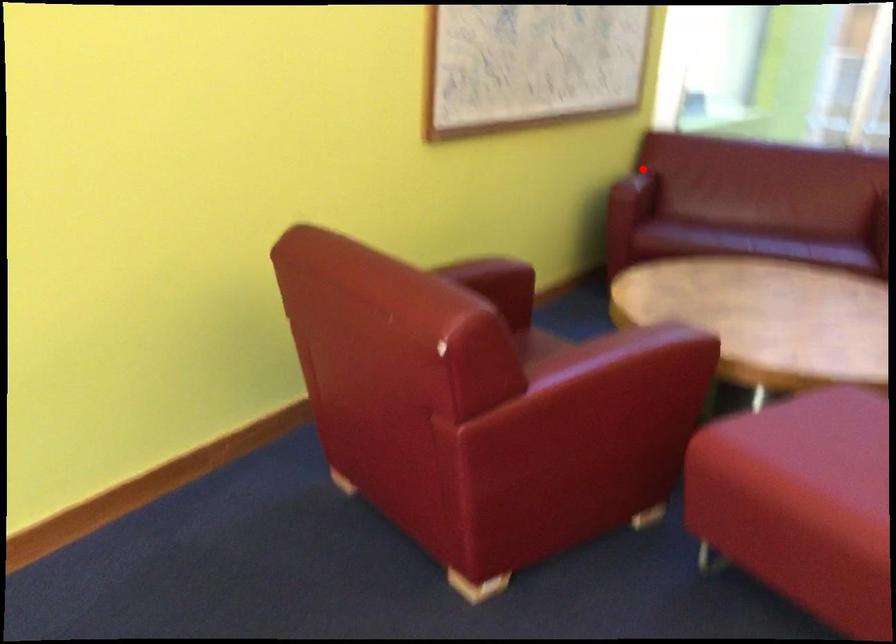
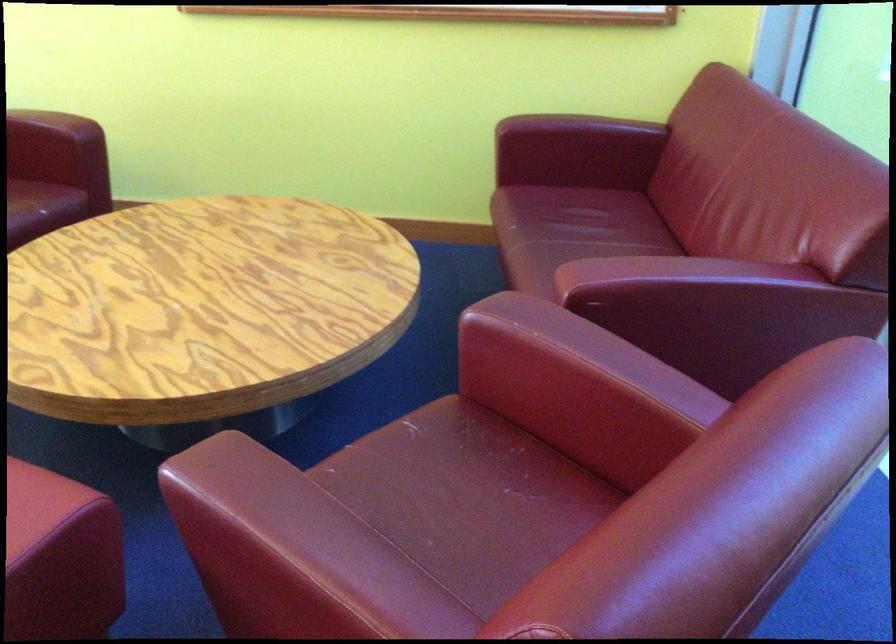
The point at the highlighted location is marked in the first image. Where is the corresponding point in the second image?

(582, 127)